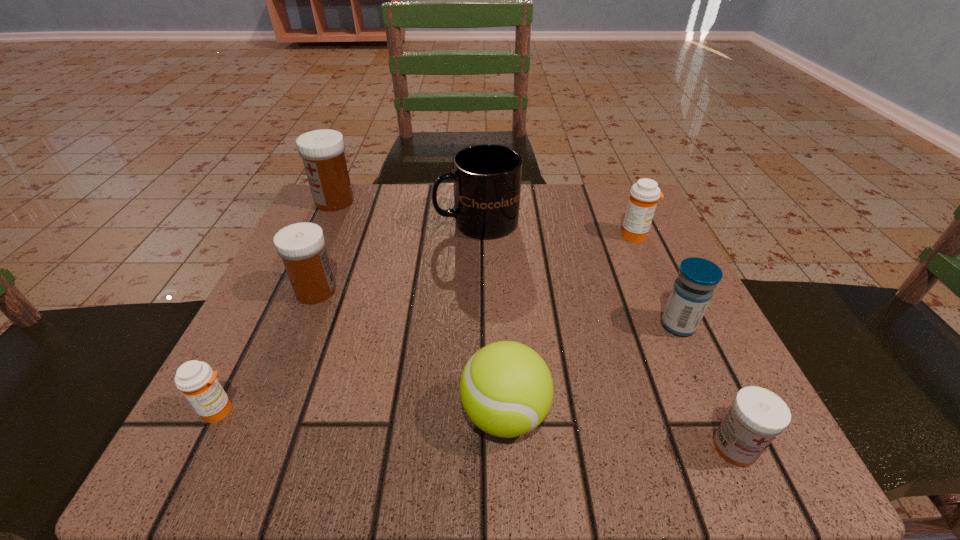
Where is `the smaller orange medicine`? The height and width of the screenshot is (540, 960). the smaller orange medicine is located at coordinates (197, 381).

This screenshot has height=540, width=960. I want to click on the left orange medicine, so click(197, 381).

Where is `the smallest white medicine`? the smallest white medicine is located at coordinates (758, 415).

You are a GUI agent. You are given a task and a screenshot of the screen. Output one action in this format:
    pyautogui.click(x=<x>, y=<y>)
    Task: Click on the rightmost white medicine
    Image resolution: width=960 pixels, height=540 pixels.
    Given the screenshot: What is the action you would take?
    pyautogui.click(x=758, y=415)

I want to click on free space located on the front of the biggest white medicine, so click(x=293, y=290).

The height and width of the screenshot is (540, 960). I want to click on free location located with the handle on the side of the mug, so pos(341,222).

Find the location of `free space located with the handle on the side of the mug`. free space located with the handle on the side of the mug is located at coordinates (393, 222).

Where is `free region located with the handle on the side of the mug`? The height and width of the screenshot is (540, 960). free region located with the handle on the side of the mug is located at coordinates (369, 222).

In order to click on vacant space located 0.140m on the left of the bigger orange medicine in this screenshot , I will do `click(552, 235)`.

I want to click on vacant space located 0.330m on the back of the fourth nearest medicine, so click(x=359, y=186).